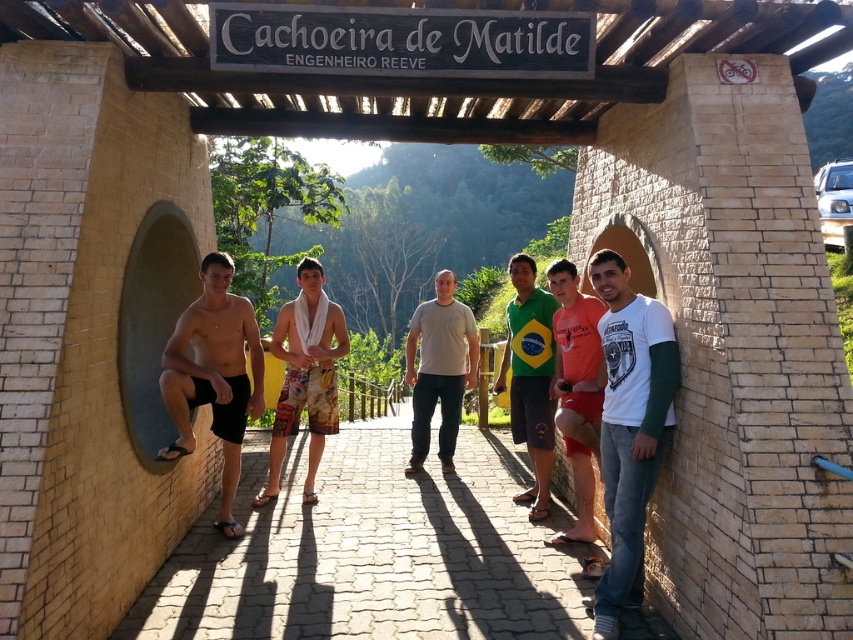
Can you confirm if paved stone path at center is positioned below green fabric shirt at center?

Yes, paved stone path at center is below green fabric shirt at center.

Does point (375, 477) come in front of point (514, 257)?

No, (375, 477) is further to viewer.

Identify the location of paved stone path at center. The height and width of the screenshot is (640, 853). (372, 552).

Which is in front, point (167, 372) or point (596, 371)?

Point (167, 372) is in front.

Is black matte shorts at left taller than orange cotton shorts at center?

No.

Does point (233, 269) come behind point (592, 493)?

Yes, point (233, 269) is farther from viewer.

This screenshot has height=640, width=853. I want to click on black matte shorts at left, so click(x=213, y=374).

Does printed cotton shorts at center have a lesser width compared to green fabric shirt at center?

No.

Is printed cotton shorts at center below green fabric shirt at center?

Indeed, printed cotton shorts at center is positioned under green fabric shirt at center.

What do you see at coordinates (305, 374) in the screenshot? The width and height of the screenshot is (853, 640). I see `printed cotton shorts at center` at bounding box center [305, 374].

Image resolution: width=853 pixels, height=640 pixels. I want to click on printed cotton shorts at center, so click(x=305, y=374).